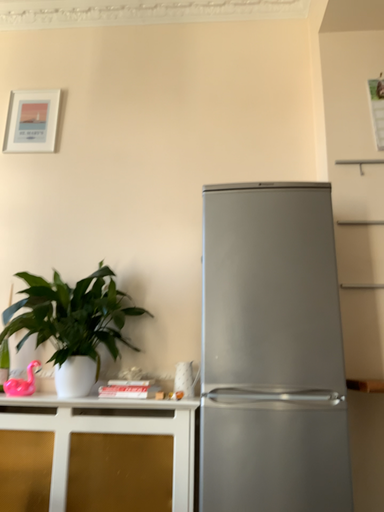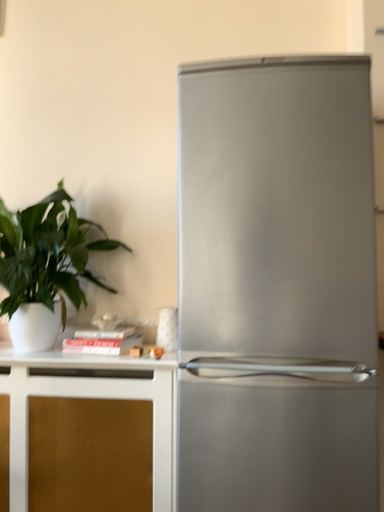
Question: How did the camera likely rotate when shooting the video?

Choices:
 (A) rotated downward
 (B) rotated upward

Answer: (A)